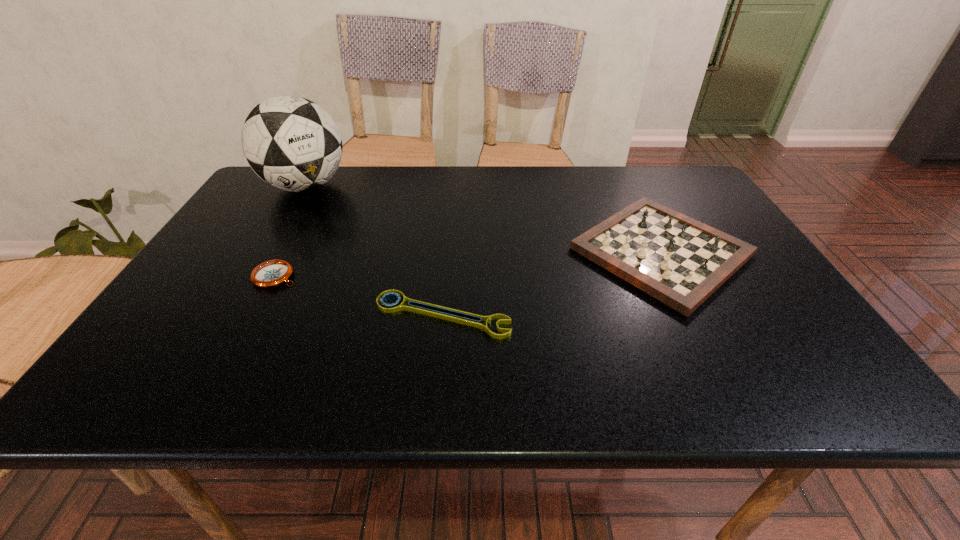
What are the coordinates of `soccer ball` in the screenshot? It's located at (291, 143).

The width and height of the screenshot is (960, 540). Find the location of `the second tallest object`. the second tallest object is located at coordinates (680, 261).

Locate an element on the screen. chessboard is located at coordinates pyautogui.click(x=680, y=261).

This screenshot has width=960, height=540. Identify the location of compass. (272, 273).

The height and width of the screenshot is (540, 960). I want to click on the shortest object, so click(453, 315).

At what (x,y) coordinates should I click in order to perform the action: click on wrench. Please return your answer as a coordinate pair (x, y). The height and width of the screenshot is (540, 960). Looking at the image, I should click on (453, 315).

Identify the location of vacant space situated on the surface of the soccer ball where the brand logo is visible. This screenshot has width=960, height=540. (271, 245).

Find the location of a particular element. The height and width of the screenshot is (540, 960). free location located on the front of the chessboard is located at coordinates 714,357.

At what (x,y) coordinates should I click in order to perform the action: click on blank area located 0.390m on the back of the compass. Please return your answer as a coordinate pair (x, y). The width and height of the screenshot is (960, 540). Looking at the image, I should click on (324, 185).

Image resolution: width=960 pixels, height=540 pixels. Identify the location of free point located on the right of the shortest object. (659, 315).